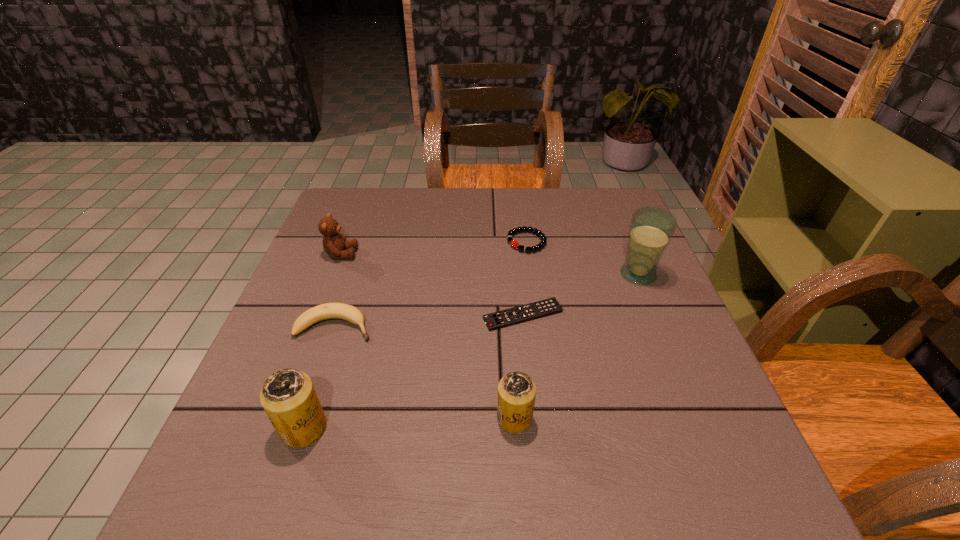
The width and height of the screenshot is (960, 540). What are the coordinates of `free point that satisfies the following two spatial constraints: 1. on the back side of the shortest object; 2. on the right side of the bracelet` in the screenshot? It's located at (516, 242).

The width and height of the screenshot is (960, 540). Identify the location of free region that satisfies the following two spatial constraints: 1. on the back side of the remote control; 2. on the face of the teddy bear. (516, 254).

Where is `free spot that satisfies the following two spatial constraints: 1. on the back side of the sixth shortest object; 2. on the left side of the tallest object`? free spot that satisfies the following two spatial constraints: 1. on the back side of the sixth shortest object; 2. on the left side of the tallest object is located at coordinates (354, 274).

Find the location of a particular element. free spot that satisfies the following two spatial constraints: 1. on the face of the teddy bear; 2. on the back side of the rightmost object is located at coordinates (333, 274).

This screenshot has width=960, height=540. I want to click on free space that satisfies the following two spatial constraints: 1. on the back side of the rightmost object; 2. on the face of the teddy bear, so click(x=630, y=254).